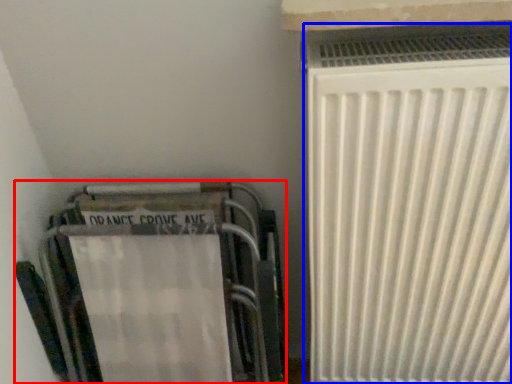
Question: Among these objects, which one is farthest to the camera, furniture (highlighted by a red box) or radiator (highlighted by a blue box)?

Choices:
 (A) furniture
 (B) radiator

Answer: (A)